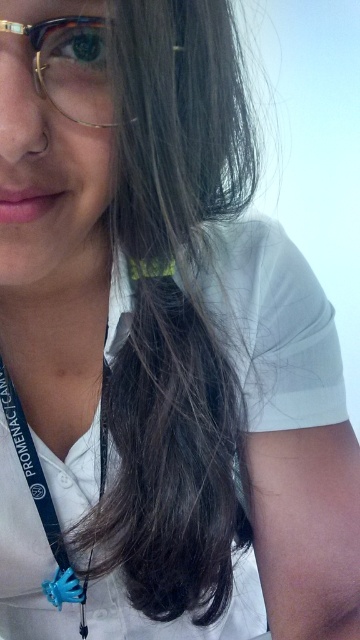
Looking at this image, you are a photographer adjusting the focus on your camera. You want to capture both the white fabric at center and the blue rubber lanyard at center in sharp detail. Given that your camera has a depth of field that can cover 2 inches, will both objects be in focus?

The distance between the white fabric at center and the blue rubber lanyard at center is 2.06 inches. Since the depth of field can cover 2 inches, the distance exceeds the camera setting, so both objects may not be in focus simultaneously.

You are a photographer adjusting the lighting for a portrait. You notice the white fabric at center and the tortoiseshell acetate glasses at upper left. Which object should you focus your light on to ensure the larger one is properly illuminated?

The white fabric at center is larger in size than the tortoiseshell acetate glasses at upper left, so you should focus the light on the white fabric at center to ensure it is properly illuminated.

You are an AI analyzing a portrait photo. The subject is wearing a white shirt and has dark brown hair. There is a specific point in the image at coordinates point (59, 340). What object in the scene is located at this point?

The white fabric at center is located at point (59, 340).